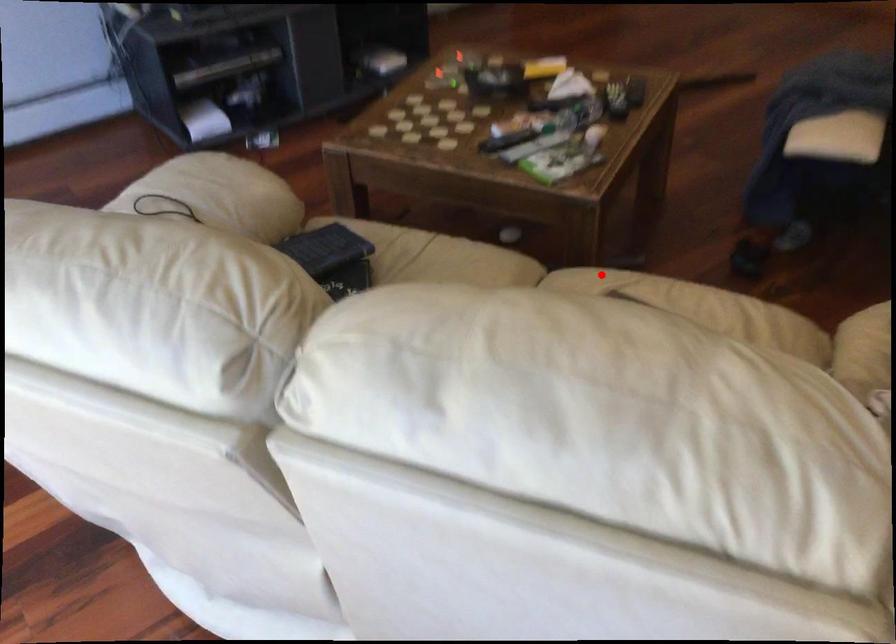
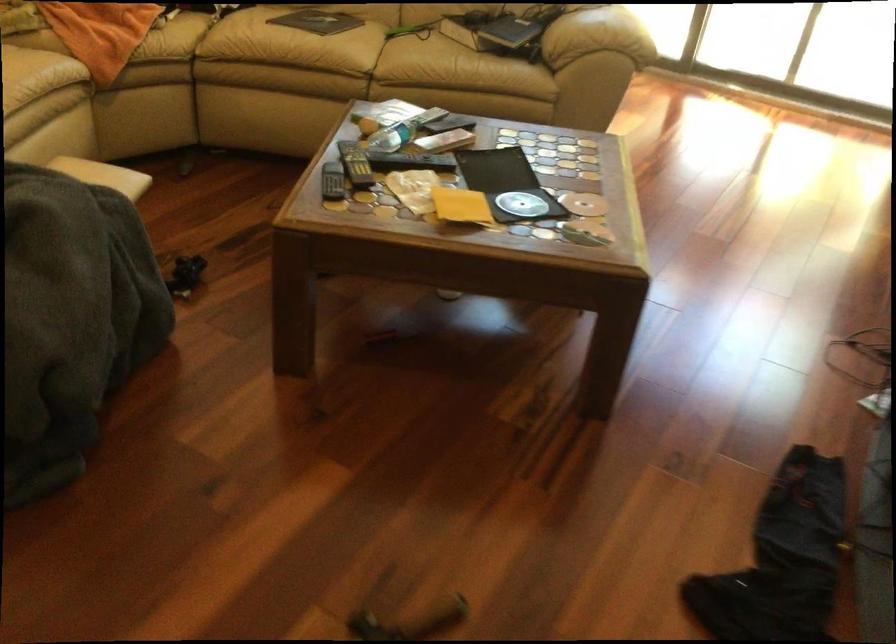
Question: I am providing you with two images of the same scene from different viewpoints. Given a red point in image1, look at the same physical point in image2. Is it:

Choices:
 (A) Closer to the viewpoint
 (B) Farther from the viewpoint

Answer: (B)